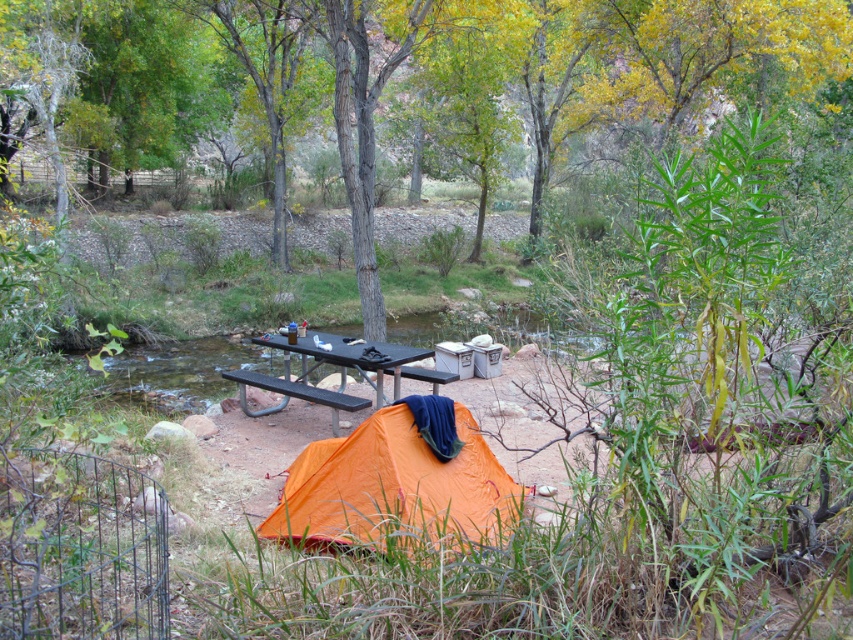
The image size is (853, 640). What do you see at coordinates (421, 77) in the screenshot? I see `green leafy tree at center` at bounding box center [421, 77].

Looking at this image, which is more to the right, green leafy tree at center or black metal picnic table at center?

Positioned to the right is green leafy tree at center.

The height and width of the screenshot is (640, 853). I want to click on green leafy tree at center, so click(x=421, y=77).

Can you confirm if green leafy tree at center is taller than orange nylon tent at lower center?

Yes, green leafy tree at center is taller than orange nylon tent at lower center.

Is point (341, 124) farther from viewer compared to point (351, 499)?

Yes, point (341, 124) is behind point (351, 499).

Where is `green leafy tree at center`? The height and width of the screenshot is (640, 853). green leafy tree at center is located at coordinates (421, 77).

Is orange nylon tent at lower center further to camera compared to black metal picnic table at center?

That is False.

Between orange nylon tent at lower center and black metal picnic table at center, which one is positioned lower?

orange nylon tent at lower center

Describe the element at coordinates (393, 486) in the screenshot. I see `orange nylon tent at lower center` at that location.

Where is `orange nylon tent at lower center`? orange nylon tent at lower center is located at coordinates (393, 486).